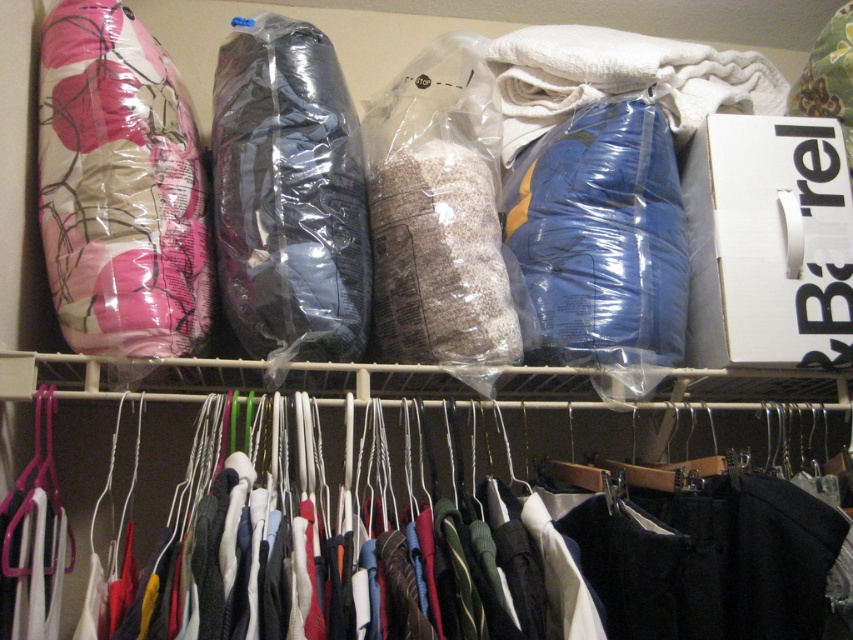
You are organizing the closet and need to access the pink floral fabric pillow at upper left. However, there are polyester hangers at center blocking your path. Can you reach the pillow without moving the hangers?

The polyester hangers at center are in front of the pink floral fabric pillow at upper left, so you cannot reach the pillow without moving the hangers.